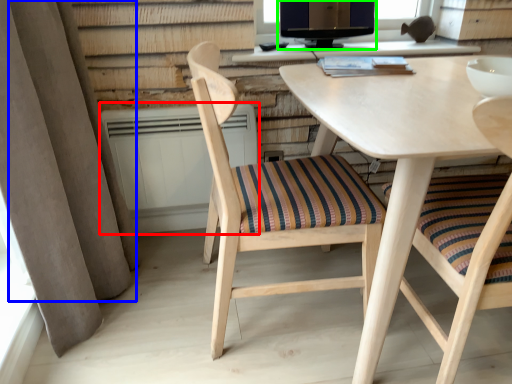
Question: Considering the real-world distances, which object is farthest from radiator (highlighted by a red box)? curtain (highlighted by a blue box) or computer monitor (highlighted by a green box)?

Choices:
 (A) curtain
 (B) computer monitor

Answer: (B)